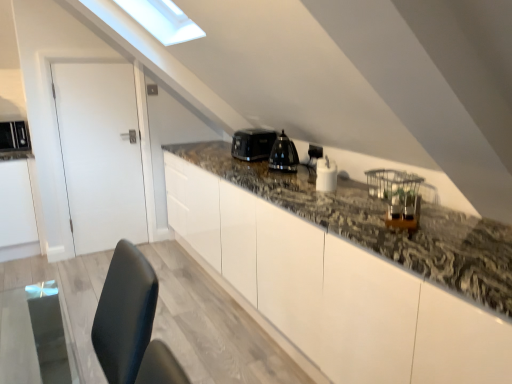
Locate an element on the screen. Image resolution: width=512 pixels, height=384 pixels. free space to the left of white glossy salt shaker at center, the first appliance viewed from the front is located at coordinates (278, 187).